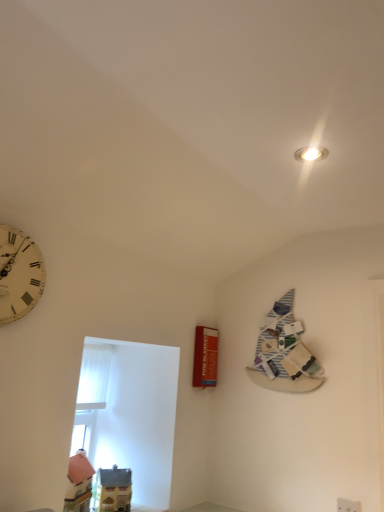
Question: Considering their positions, is red matte fire blanket at center-right located in front of or behind white vintage clock at left?

Choices:
 (A) behind
 (B) front

Answer: (A)

Question: From the image's perspective, is red matte fire blanket at center-right located above or below white vintage clock at left?

Choices:
 (A) above
 (B) below

Answer: (B)

Question: Based on their relative distances, which object is nearer to the white plastic electric outlet at lower right?

Choices:
 (A) red matte fire blanket at center-right
 (B) striped paper book at upper right
 (C) white vintage clock at left

Answer: (B)

Question: Considering the real-world distances, which object is closest to the white plastic electric outlet at lower right?

Choices:
 (A) white vintage clock at left
 (B) red matte fire blanket at center-right
 (C) striped paper book at upper right

Answer: (C)